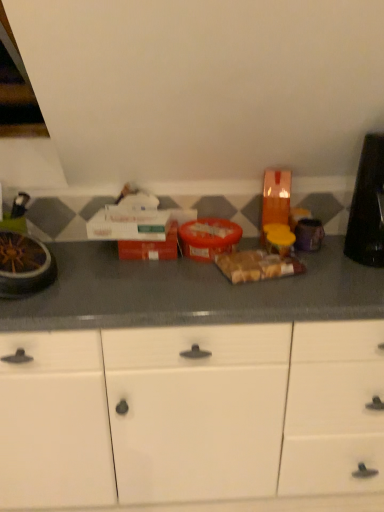
The height and width of the screenshot is (512, 384). I want to click on vacant area located to the right-hand side of translucent plastic bag of bread at center, so click(x=320, y=271).